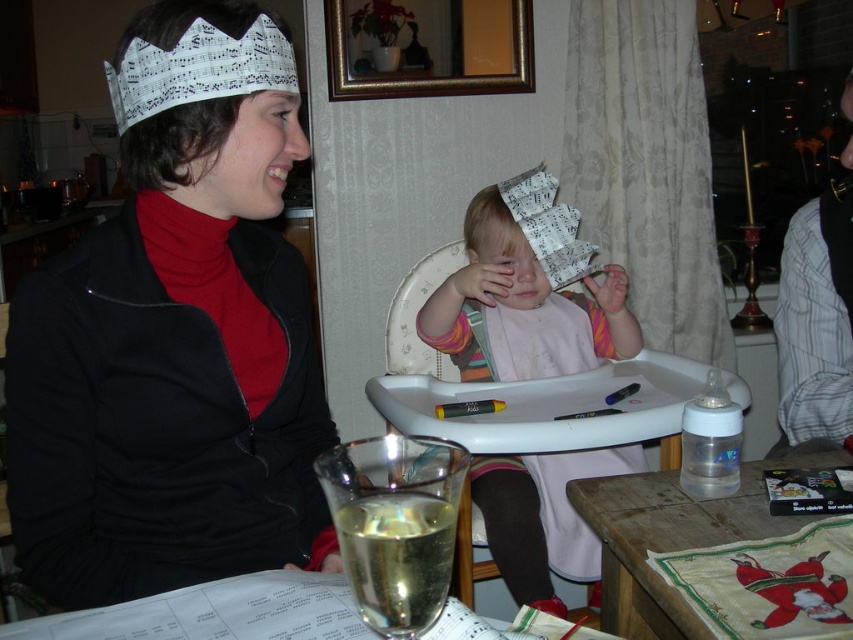
How far apart are matte black jacket at upper left and translucent glass at lower center?

matte black jacket at upper left and translucent glass at lower center are 21.30 inches apart from each other.

Is matte black jacket at upper left bigger than translucent glass at lower center?

Indeed, matte black jacket at upper left has a larger size compared to translucent glass at lower center.

Between point (93, 596) and point (393, 484), which one is positioned behind?

The point (93, 596) is behind.

This screenshot has width=853, height=640. I want to click on matte black jacket at upper left, so click(172, 372).

Which is in front, point (160, 333) or point (556, 438)?

Point (160, 333)

The height and width of the screenshot is (640, 853). I want to click on matte black jacket at upper left, so click(x=172, y=372).

Based on the photo, can you confirm if wooden table at center is shorter than wooden table at lower right?

In fact, wooden table at center may be taller than wooden table at lower right.

Is wooden table at center to the left of wooden table at lower right from the viewer's perspective?

Correct, you'll find wooden table at center to the left of wooden table at lower right.

Describe the element at coordinates (550, 406) in the screenshot. I see `wooden table at center` at that location.

Locate an element on the screen. The height and width of the screenshot is (640, 853). wooden table at center is located at coordinates (550, 406).